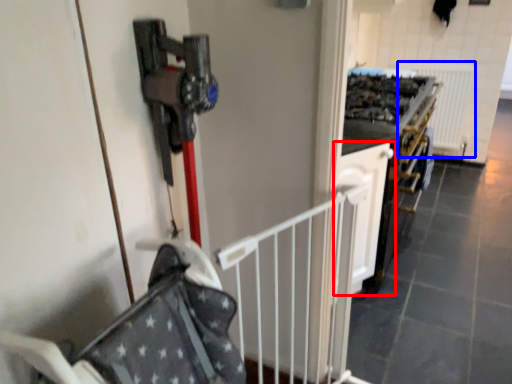
Question: Which object appears farthest to the camera in this image, cabinetry (highlighted by a red box) or radiator (highlighted by a blue box)?

Choices:
 (A) cabinetry
 (B) radiator

Answer: (B)